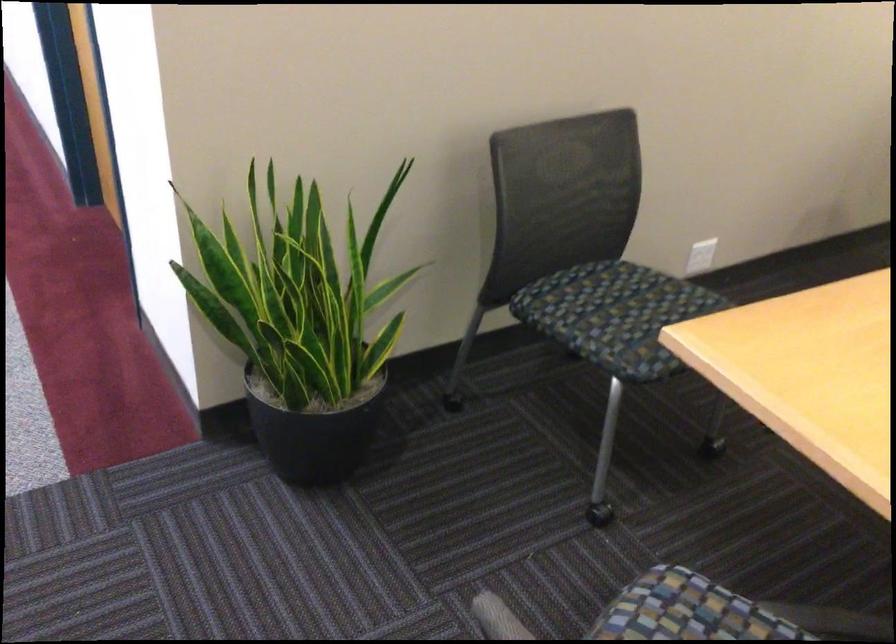
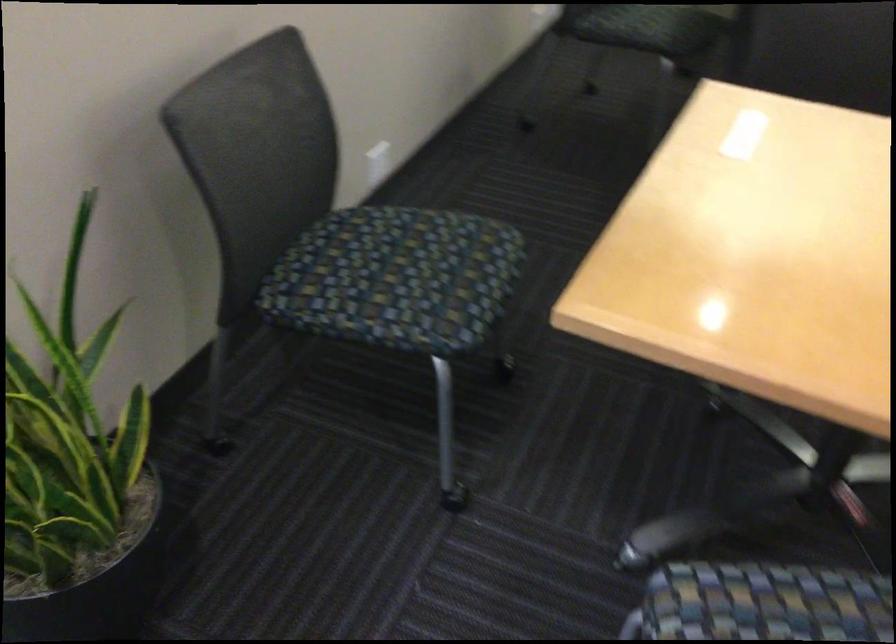
Find the pixel in the second image that matches (632,313) in the first image.

(395, 278)